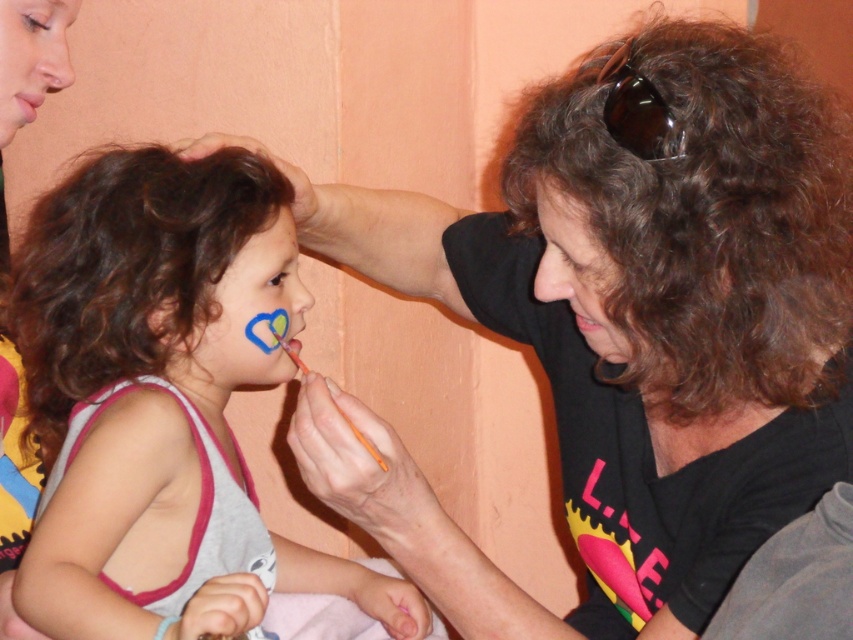
You are an observer looking at the scene of a woman painting a child. You notice the brown curly hair at upper right and the smooth skin at upper left. Which object is positioned lower in the image?

The brown curly hair at upper right is located below smooth skin at upper left, so the brown curly hair at upper right is positioned lower in the image.

You are an artist trying to replicate the scene. The woman is painting the child, and you need to position the brown curly hair at upper right correctly. Where should you place it in terms of coordinates?

The brown curly hair at upper right should be placed at coordinates point (x=703, y=211) as specified in the description.